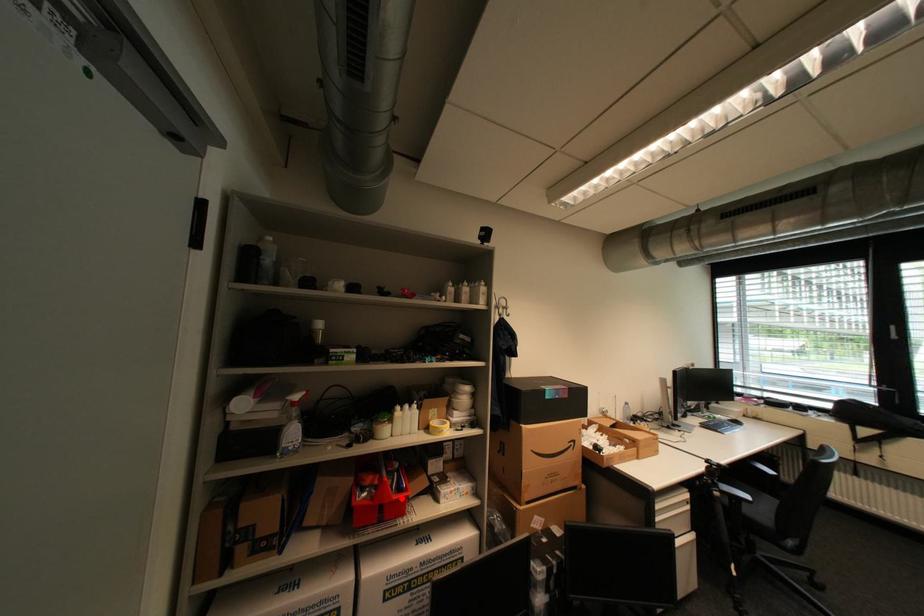
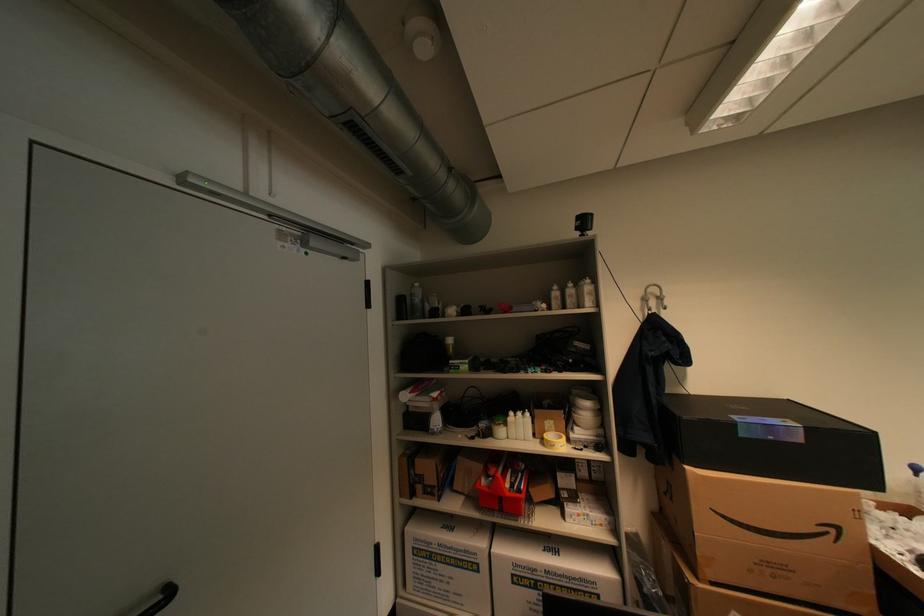
Question: I am providing you with two images of the same scene from different viewpoints. In image1, a red point is highlighted. Considering the same 3D point in image2, which of the following is correct?

Choices:
 (A) It is closer
 (B) It is farther

Answer: (B)